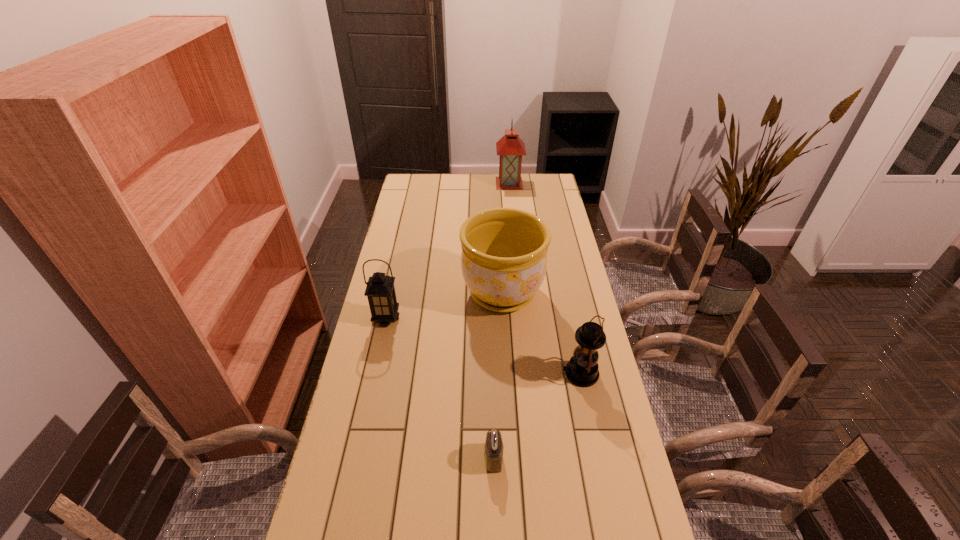
What are the coordinates of `the second lantern from left to right` in the screenshot? It's located at (510, 147).

You are a GUI agent. You are given a task and a screenshot of the screen. Output one action in this format:
    pyautogui.click(x=<x>, y=<y>)
    Task: Click on the tallest object
    
    Given the screenshot: What is the action you would take?
    pyautogui.click(x=510, y=147)

At what (x,y) coordinates should I click in order to perform the action: click on flowerpot. Please return your answer as a coordinate pair (x, y). The image size is (960, 540). Looking at the image, I should click on (504, 250).

You are a GUI agent. You are given a task and a screenshot of the screen. Output one action in this format:
    pyautogui.click(x=<x>, y=<y>)
    Task: Click on the leftmost object
    This screenshot has height=540, width=960.
    Given the screenshot: What is the action you would take?
    pyautogui.click(x=380, y=291)

Identify the location of the leftmost lantern. Image resolution: width=960 pixels, height=540 pixels. (380, 291).

Locate an element on the screen. Image resolution: width=960 pixels, height=540 pixels. the fourth farthest object is located at coordinates (582, 370).

Where is `the rightmost object`? The width and height of the screenshot is (960, 540). the rightmost object is located at coordinates (582, 370).

Locate an element on the screen. This screenshot has width=960, height=540. the shortest object is located at coordinates (494, 447).

The image size is (960, 540). I want to click on the nearest object, so click(x=494, y=447).

This screenshot has height=540, width=960. Identify the location of vacant point located on the left of the tallest object. (444, 183).